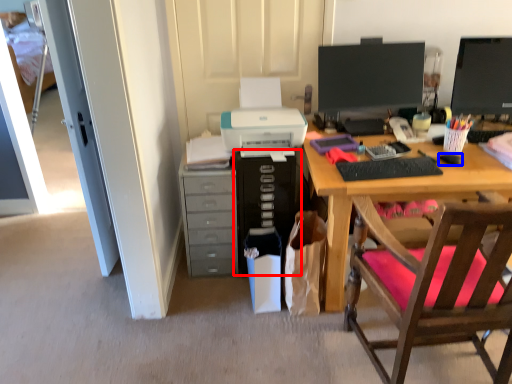
Question: Which of the following is the farthest to the observer, computer tower (highlighted by a red box) or mouse (highlighted by a blue box)?

Choices:
 (A) computer tower
 (B) mouse

Answer: (A)